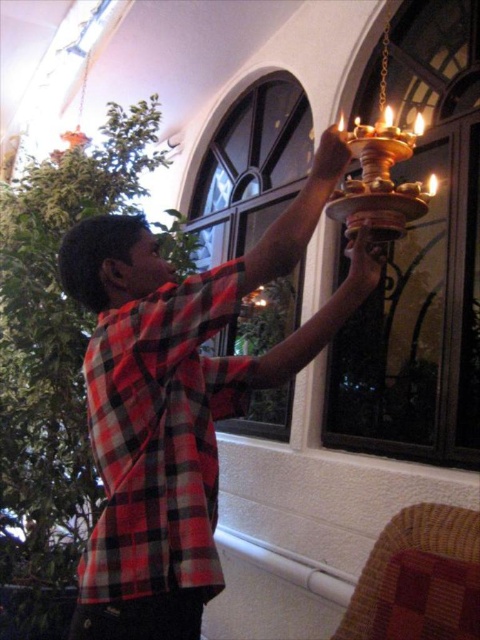
Based on the photo, you are an interior designer assessing the placement of the red plaid shirt at center and the red plaid shirt at upper center in the room. Which of these two items occupies more horizontal space in the scene?

The red plaid shirt at center is wider than the red plaid shirt at upper center, so it occupies more horizontal space in the scene.

You are standing in the room and want to know how far you are from the point marked at coordinates point (187, 376). Can you determine the distance?

The distance between point (187, 376) and the camera is 1.17 meters, so you are 1.17 meters away from the point marked at coordinates point (187, 376).

In the scene shown: You are an interior designer assessing the placement of the red plaid shirt at center and the red plaid shirt at upper center in the room. Which of these two shirts is positioned lower in the scene?

The red plaid shirt at center is positioned lower in the scene because it has a greater height compared to the red plaid shirt at upper center.